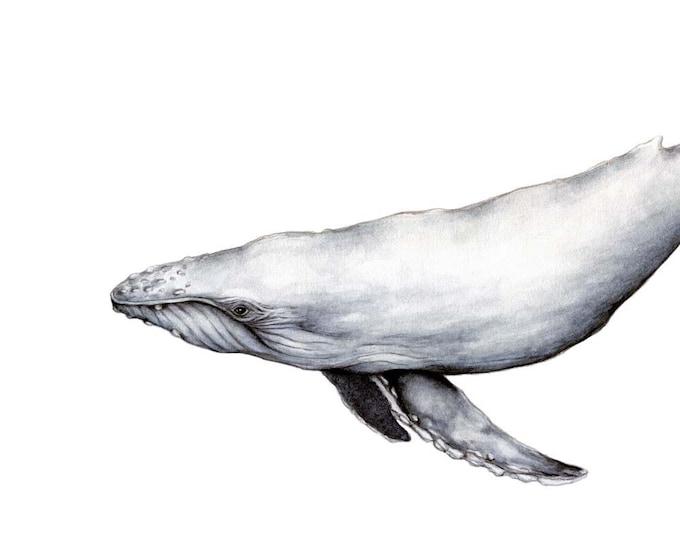
Locate an element on the screen. Image resolution: width=680 pixels, height=540 pixels. rostrum is located at coordinates (112, 292).